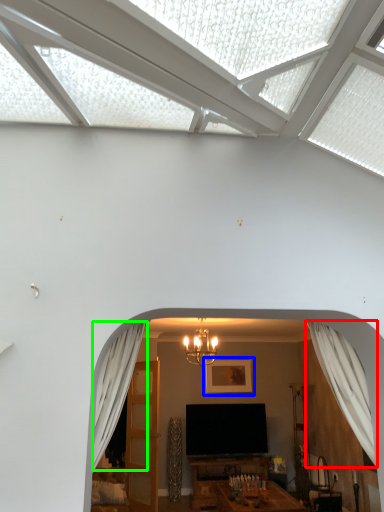
Question: Which is nearer to the curtain (highlighted by a red box)? picture frame (highlighted by a blue box) or curtain (highlighted by a green box).

Choices:
 (A) picture frame
 (B) curtain

Answer: (B)